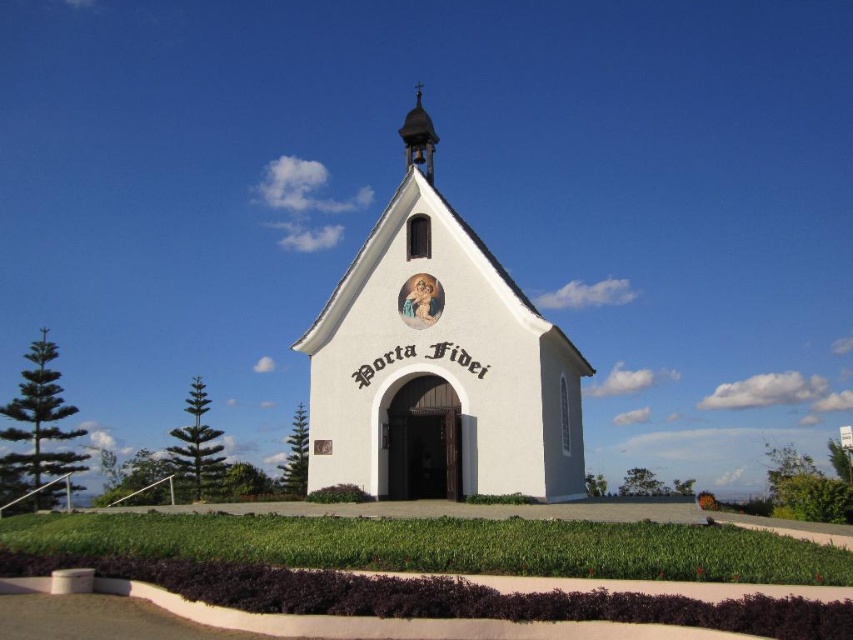
Which is in front, point (553, 445) or point (416, 86)?

Point (553, 445)

How much distance is there between white painted wood chapel at center and shiny gold spire at upper center?

They are 8.08 meters apart.

Identify the location of white painted wood chapel at center. Image resolution: width=853 pixels, height=640 pixels. (439, 369).

I want to click on white painted wood chapel at center, so coord(439,369).